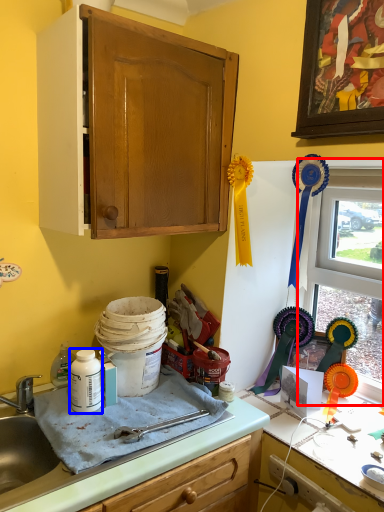
Question: Which object is further to the camera taking this photo, window (highlighted by a red box) or bottle (highlighted by a blue box)?

Choices:
 (A) window
 (B) bottle

Answer: (A)